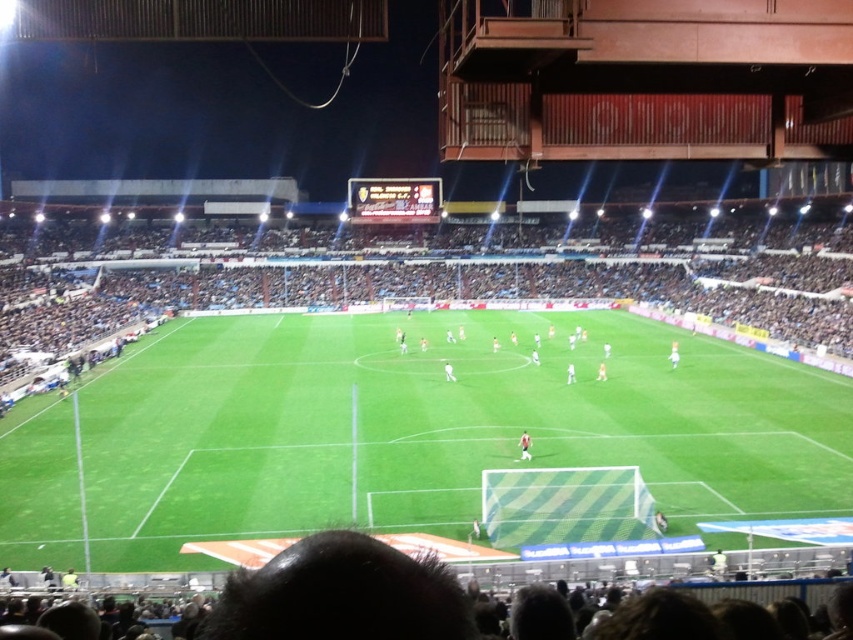
Question: Which point is closer to the camera?

Choices:
 (A) tap(671, 371)
 (B) tap(49, 314)

Answer: (A)

Question: Does green grass football field at center have a smaller size compared to blue fabric crowd at left?

Choices:
 (A) no
 (B) yes

Answer: (B)

Question: Can you confirm if green grass football field at center is bigger than blue fabric crowd at left?

Choices:
 (A) no
 (B) yes

Answer: (A)

Question: Is green grass football field at center positioned behind blue fabric crowd at left?

Choices:
 (A) no
 (B) yes

Answer: (A)